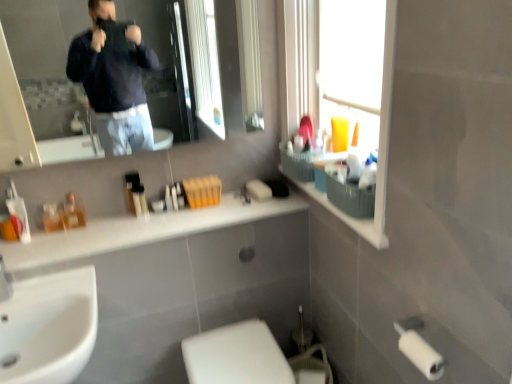
Question: Is the depth of white glossy sink at lower left less than that of white glossy toilet at lower center?

Choices:
 (A) no
 (B) yes

Answer: (B)

Question: From a real-world perspective, does white glossy sink at lower left sit lower than white glossy toilet at lower center?

Choices:
 (A) yes
 (B) no

Answer: (B)

Question: Does white glossy sink at lower left have a lesser height compared to white glossy toilet at lower center?

Choices:
 (A) no
 (B) yes

Answer: (A)

Question: Can you confirm if white glossy sink at lower left is wider than white glossy toilet at lower center?

Choices:
 (A) no
 (B) yes

Answer: (B)

Question: Is white glossy sink at lower left to the right of white glossy toilet at lower center from the viewer's perspective?

Choices:
 (A) no
 (B) yes

Answer: (A)

Question: From a real-world perspective, is white glossy sink at lower left on top of white glossy toilet at lower center?

Choices:
 (A) no
 (B) yes

Answer: (B)

Question: Can you confirm if white glossy toilet at lower center is taller than transparent plastic window screen at upper right?

Choices:
 (A) yes
 (B) no

Answer: (A)

Question: From the image's perspective, is white glossy toilet at lower center above transparent plastic window screen at upper right?

Choices:
 (A) no
 (B) yes

Answer: (A)

Question: Is white glossy toilet at lower center closer to the viewer compared to transparent plastic window screen at upper right?

Choices:
 (A) no
 (B) yes

Answer: (A)

Question: Could transparent plastic window screen at upper right be considered to be inside white glossy toilet at lower center?

Choices:
 (A) yes
 (B) no

Answer: (B)

Question: Is white glossy toilet at lower center directly adjacent to transparent plastic window screen at upper right?

Choices:
 (A) yes
 (B) no

Answer: (B)

Question: Does white glossy toilet at lower center appear on the left side of transparent plastic window screen at upper right?

Choices:
 (A) no
 (B) yes

Answer: (B)

Question: From the image's perspective, is white glossy sink at lower left above translucent plastic basket at upper right?

Choices:
 (A) yes
 (B) no

Answer: (B)